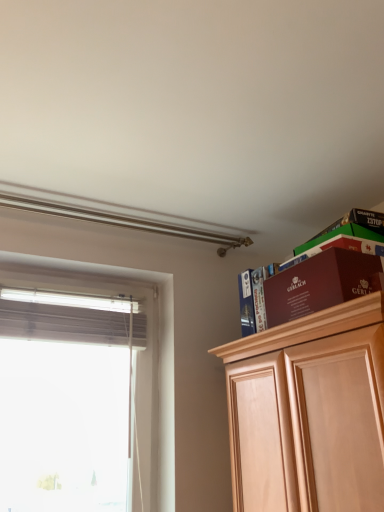
Question: From the image's perspective, does maroon cardboard box at upper right appear lower than white matte window at left?

Choices:
 (A) no
 (B) yes

Answer: (A)

Question: Could white matte window at left be considered to be inside maroon cardboard box at upper right?

Choices:
 (A) yes
 (B) no

Answer: (B)

Question: Does maroon cardboard box at upper right have a lesser width compared to white matte window at left?

Choices:
 (A) no
 (B) yes

Answer: (A)

Question: Does maroon cardboard box at upper right appear on the left side of white matte window at left?

Choices:
 (A) yes
 (B) no

Answer: (B)

Question: Is the position of maroon cardboard box at upper right more distant than that of white matte window at left?

Choices:
 (A) yes
 (B) no

Answer: (B)

Question: From a real-world perspective, is matte brown book at upper right physically located above or below white matte window at left?

Choices:
 (A) below
 (B) above

Answer: (B)

Question: Which is correct: matte brown book at upper right is inside white matte window at left, or outside of it?

Choices:
 (A) outside
 (B) inside

Answer: (A)

Question: Based on their sizes in the image, would you say matte brown book at upper right is bigger or smaller than white matte window at left?

Choices:
 (A) small
 (B) big

Answer: (A)

Question: Is matte brown book at upper right in front of or behind white matte window at left in the image?

Choices:
 (A) behind
 (B) front

Answer: (A)

Question: From a real-world perspective, is maroon cardboard box at upper right physically located above or below white matte window at left?

Choices:
 (A) below
 (B) above

Answer: (B)

Question: In the image, is maroon cardboard box at upper right on the left side or the right side of white matte window at left?

Choices:
 (A) left
 (B) right

Answer: (B)

Question: Is maroon cardboard box at upper right bigger or smaller than white matte window at left?

Choices:
 (A) small
 (B) big

Answer: (A)

Question: Is maroon cardboard box at upper right wider or thinner than white matte window at left?

Choices:
 (A) wide
 (B) thin

Answer: (A)

Question: From the image's perspective, relative to matte brown book at upper right, is white matte window at left above or below?

Choices:
 (A) above
 (B) below

Answer: (B)

Question: Which is correct: white matte window at left is inside matte brown book at upper right, or outside of it?

Choices:
 (A) inside
 (B) outside

Answer: (B)